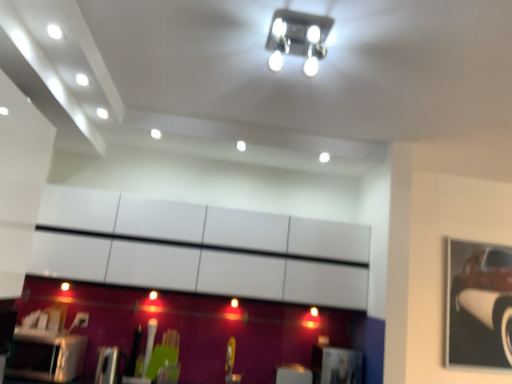
Question: Does metallic silver toaster at lower left have a lesser height compared to metallic car at right?

Choices:
 (A) yes
 (B) no

Answer: (A)

Question: From the image's perspective, is metallic silver toaster at lower left below metallic car at right?

Choices:
 (A) no
 (B) yes

Answer: (B)

Question: Considering the relative sizes of metallic silver toaster at lower left and metallic car at right in the image provided, is metallic silver toaster at lower left bigger than metallic car at right?

Choices:
 (A) yes
 (B) no

Answer: (A)

Question: From a real-world perspective, is metallic silver toaster at lower left positioned under metallic car at right based on gravity?

Choices:
 (A) yes
 (B) no

Answer: (A)

Question: From the image's perspective, is metallic silver toaster at lower left on metallic car at right?

Choices:
 (A) yes
 (B) no

Answer: (B)

Question: Do you think metallic silver toaster at lower left is within metallic square light fixture at upper center, or outside of it?

Choices:
 (A) outside
 (B) inside

Answer: (A)

Question: From the image's perspective, is metallic silver toaster at lower left located above or below metallic square light fixture at upper center?

Choices:
 (A) above
 (B) below

Answer: (B)

Question: Looking at the image, does metallic silver toaster at lower left seem bigger or smaller compared to metallic square light fixture at upper center?

Choices:
 (A) big
 (B) small

Answer: (A)

Question: Is metallic silver toaster at lower left wider or thinner than metallic square light fixture at upper center?

Choices:
 (A) wide
 (B) thin

Answer: (A)

Question: From the image's perspective, is metallic square light fixture at upper center positioned above or below metallic car at right?

Choices:
 (A) above
 (B) below

Answer: (A)

Question: Considering the positions of point (271, 33) and point (509, 291), is point (271, 33) closer or farther from the camera than point (509, 291)?

Choices:
 (A) farther
 (B) closer

Answer: (B)

Question: From a real-world perspective, is metallic square light fixture at upper center positioned above or below metallic car at right?

Choices:
 (A) below
 (B) above

Answer: (B)

Question: Based on their sizes in the image, would you say metallic square light fixture at upper center is bigger or smaller than metallic car at right?

Choices:
 (A) small
 (B) big

Answer: (A)

Question: In terms of height, does metallic car at right look taller or shorter compared to metallic silver toaster at lower left?

Choices:
 (A) tall
 (B) short

Answer: (A)

Question: From a real-world perspective, is metallic car at right above or below metallic silver toaster at lower left?

Choices:
 (A) below
 (B) above

Answer: (B)